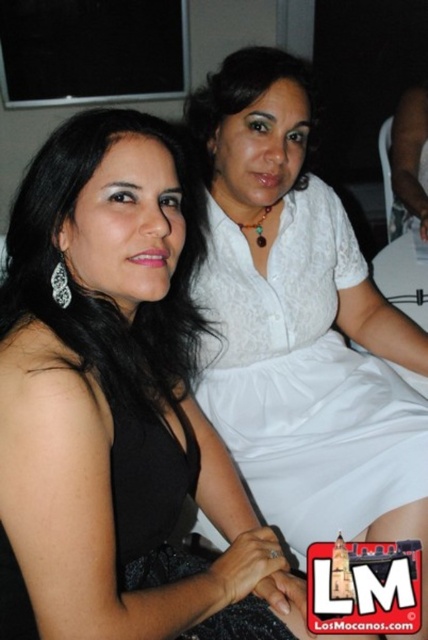
What object is located at the coordinates point (303, 378)?

The point (303, 378) indicates the white lace dress at upper right.

You are a photographer setting up for a formal event. You notice two women wearing white lace dresses in the frame. The first is wearing a white lace dress at upper right, and the second has a white lace dress at upper center. Based on their positions, which woman should you adjust to ensure both dresses are at the same height in the photo?

The white lace dress at upper right is taller than the white lace dress at upper center. To make them the same height, the woman in the white lace dress at upper center should be adjusted to stand or sit higher, or the woman in the white lace dress at upper right should lower her position.

You are a photographer adjusting your camera settings to focus on the white lace dress at upper right. The camera has a focus point at coordinates point [303,378]. Is this focus point correctly positioned to capture the white lace dress at upper right?

Yes, the focus point at point [303,378] is correctly positioned because the Objects Description states that this coordinate corresponds to the white lace dress at upper right.